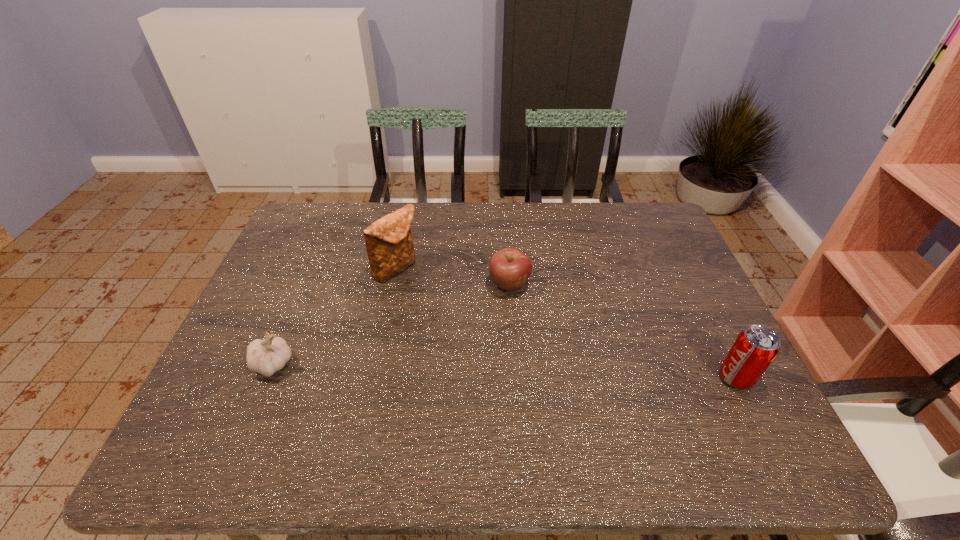
Find the location of `free space on the desktop that is between the leftmost object and the second tallest object and is positioned on the side of the shortest object with the unique marking`. free space on the desktop that is between the leftmost object and the second tallest object and is positioned on the side of the shortest object with the unique marking is located at coordinates (543, 372).

Where is `free space on the desktop that is between the garlic and the rightmost object and is positioned on the open side of the third object from right to left`? The width and height of the screenshot is (960, 540). free space on the desktop that is between the garlic and the rightmost object and is positioned on the open side of the third object from right to left is located at coordinates (515, 372).